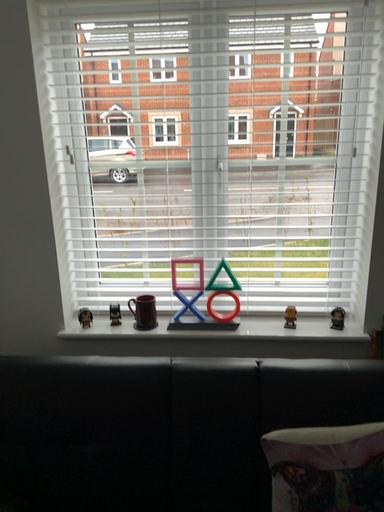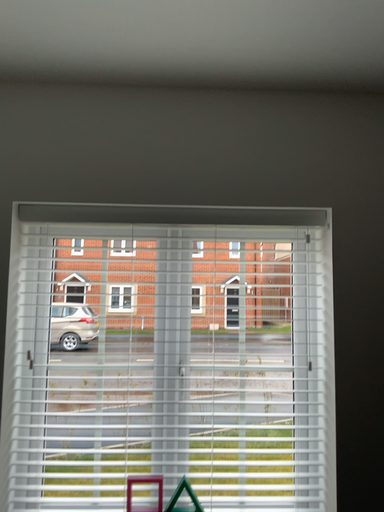
Question: Which way did the camera rotate in the video?

Choices:
 (A) rotated left
 (B) rotated right

Answer: (B)